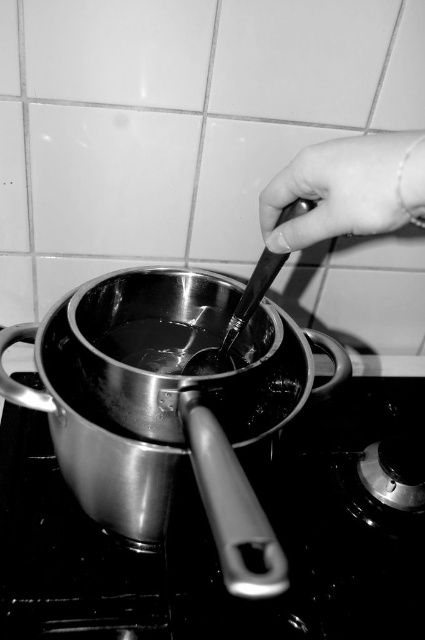
Between metallic gas stove at center and black matte spoon at center, which one has more height?

metallic gas stove at center is taller.

Between metallic gas stove at center and black matte spoon at center, which one is positioned higher?

black matte spoon at center is above.

Locate an element on the screen. metallic gas stove at center is located at coordinates (212, 544).

Who is taller, metallic gas stove at center or metallic at upper right?

metallic gas stove at center

Which is below, metallic gas stove at center or metallic at upper right?

metallic gas stove at center

What do you see at coordinates (212, 544) in the screenshot? The image size is (425, 640). I see `metallic gas stove at center` at bounding box center [212, 544].

Where is `metallic gas stove at center`? metallic gas stove at center is located at coordinates (212, 544).

Locate an element on the screen. The width and height of the screenshot is (425, 640). metallic at upper right is located at coordinates (348, 189).

Does metallic at upper right have a greater width compared to black matte spoon at center?

Yes, metallic at upper right is wider than black matte spoon at center.

The width and height of the screenshot is (425, 640). Find the location of `metallic at upper right`. metallic at upper right is located at coordinates (348, 189).

Find the location of a particular element. metallic at upper right is located at coordinates (x=348, y=189).